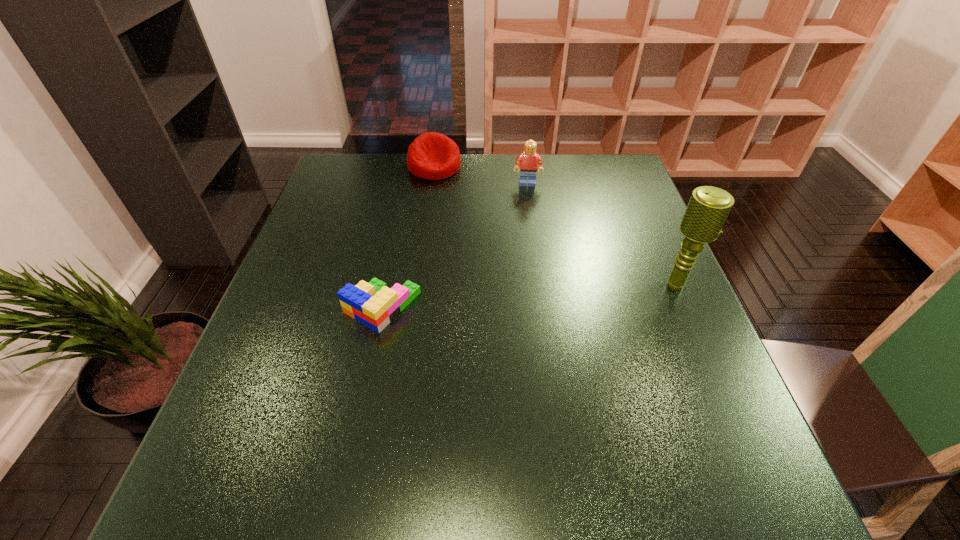
This screenshot has height=540, width=960. Find the location of `free space located on the front-facing side of the taller Lego`. free space located on the front-facing side of the taller Lego is located at coordinates (528, 222).

The image size is (960, 540). What are the coordinates of `free space located 0.230m on the front-facing side of the taller Lego` in the screenshot? It's located at (528, 237).

The width and height of the screenshot is (960, 540). Find the location of `vacant space located on the seat area of the third tallest object`. vacant space located on the seat area of the third tallest object is located at coordinates (474, 226).

Where is `vacant space positioned 0.310m on the seat area of the third tallest object`? The width and height of the screenshot is (960, 540). vacant space positioned 0.310m on the seat area of the third tallest object is located at coordinates (485, 242).

This screenshot has width=960, height=540. I want to click on blank space located on the seat area of the third tallest object, so click(x=476, y=228).

This screenshot has height=540, width=960. Find the location of `Lego present at the far edge`. Lego present at the far edge is located at coordinates (529, 160).

Image resolution: width=960 pixels, height=540 pixels. What are the coordinates of `beanbag that is at the far edge` in the screenshot? It's located at (432, 156).

Identify the location of object present at the left edge. (373, 304).

Identify the location of object present at the right edge. (708, 208).

Where is `vacant space at the far edge of the desktop`? vacant space at the far edge of the desktop is located at coordinates (434, 187).